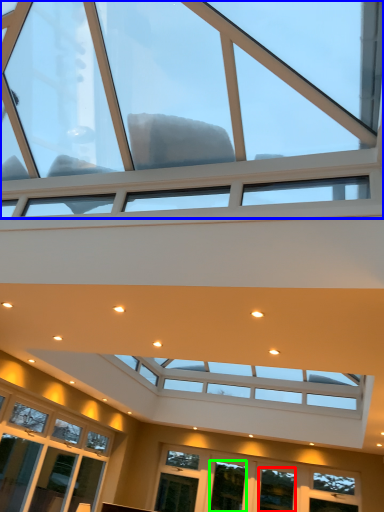
Question: Which is nearer to the window (highlighted by a red box)? window (highlighted by a blue box) or window (highlighted by a green box).

Choices:
 (A) window
 (B) window

Answer: (B)